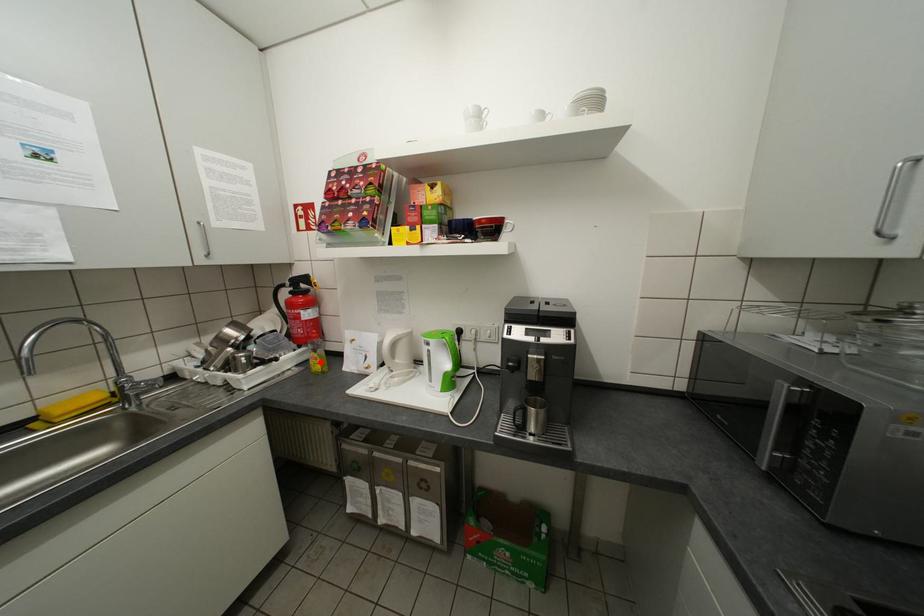
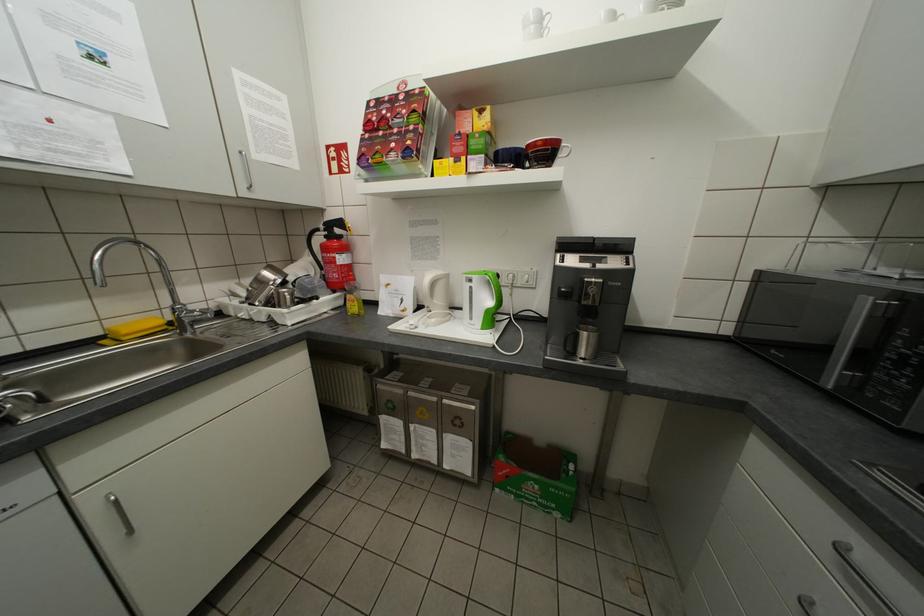
The point at the highlighted location is marked in the first image. Where is the corresponding point in the second image?

(357, 305)